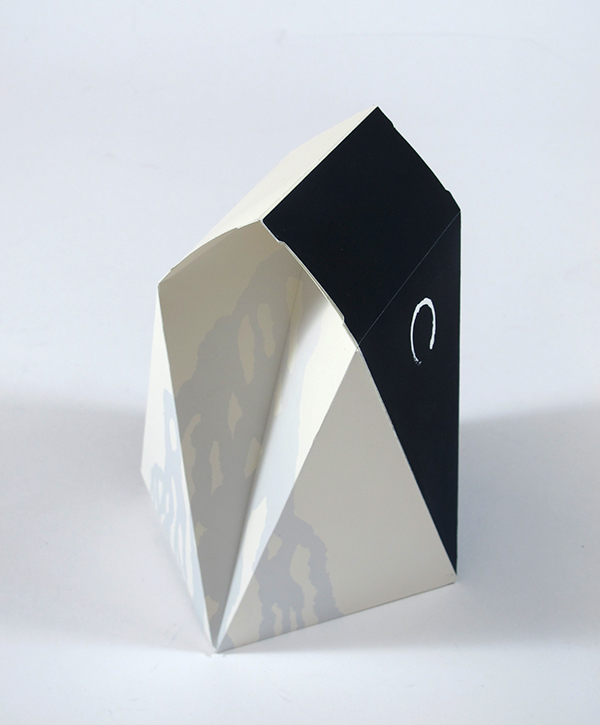
Locate an element on the screen. white wall is located at coordinates (490, 215).